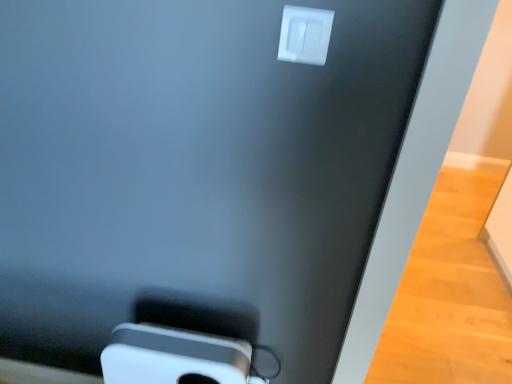
Question: Is white plastic power plugs and sockets at upper center wider than white plastic ipod at lower center?

Choices:
 (A) yes
 (B) no

Answer: (B)

Question: Would you say white plastic power plugs and sockets at upper center is a long distance from white plastic ipod at lower center?

Choices:
 (A) yes
 (B) no

Answer: (B)

Question: From a real-world perspective, is white plastic power plugs and sockets at upper center positioned over white plastic ipod at lower center based on gravity?

Choices:
 (A) no
 (B) yes

Answer: (B)

Question: Does white plastic power plugs and sockets at upper center have a lesser height compared to white plastic ipod at lower center?

Choices:
 (A) no
 (B) yes

Answer: (B)

Question: From the image's perspective, would you say white plastic power plugs and sockets at upper center is positioned over white plastic ipod at lower center?

Choices:
 (A) no
 (B) yes

Answer: (B)

Question: From a real-world perspective, is white plastic power plugs and sockets at upper center located beneath white plastic ipod at lower center?

Choices:
 (A) no
 (B) yes

Answer: (A)

Question: Is white plastic ipod at lower center to the left of white plastic power plugs and sockets at upper center from the viewer's perspective?

Choices:
 (A) yes
 (B) no

Answer: (A)

Question: From the image's perspective, would you say white plastic ipod at lower center is positioned over white plastic power plugs and sockets at upper center?

Choices:
 (A) yes
 (B) no

Answer: (B)

Question: Considering the relative sizes of white plastic ipod at lower center and white plastic power plugs and sockets at upper center in the image provided, is white plastic ipod at lower center smaller than white plastic power plugs and sockets at upper center?

Choices:
 (A) no
 (B) yes

Answer: (A)

Question: Can you confirm if white plastic ipod at lower center is bigger than white plastic power plugs and sockets at upper center?

Choices:
 (A) no
 (B) yes

Answer: (B)

Question: Is white plastic ipod at lower center to the right of white plastic power plugs and sockets at upper center from the viewer's perspective?

Choices:
 (A) yes
 (B) no

Answer: (B)

Question: Is white plastic power plugs and sockets at upper center at the back of white plastic ipod at lower center?

Choices:
 (A) yes
 (B) no

Answer: (B)

Question: In terms of height, does white plastic power plugs and sockets at upper center look taller or shorter compared to white plastic ipod at lower center?

Choices:
 (A) short
 (B) tall

Answer: (A)